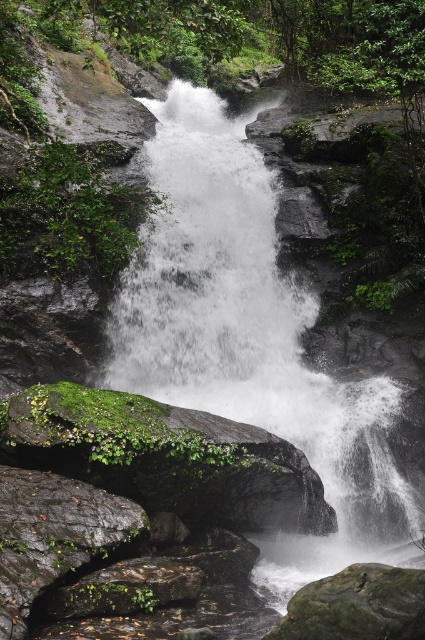
You are a hiker who wants to cross the river at the base of the waterfall. You see the white frothy water at center and the smooth gray rock at lower center. How far apart are these two landmarks?

The white frothy water at center is 4.75 meters away from the smooth gray rock at lower center, so the distance between them is 4.75 meters.